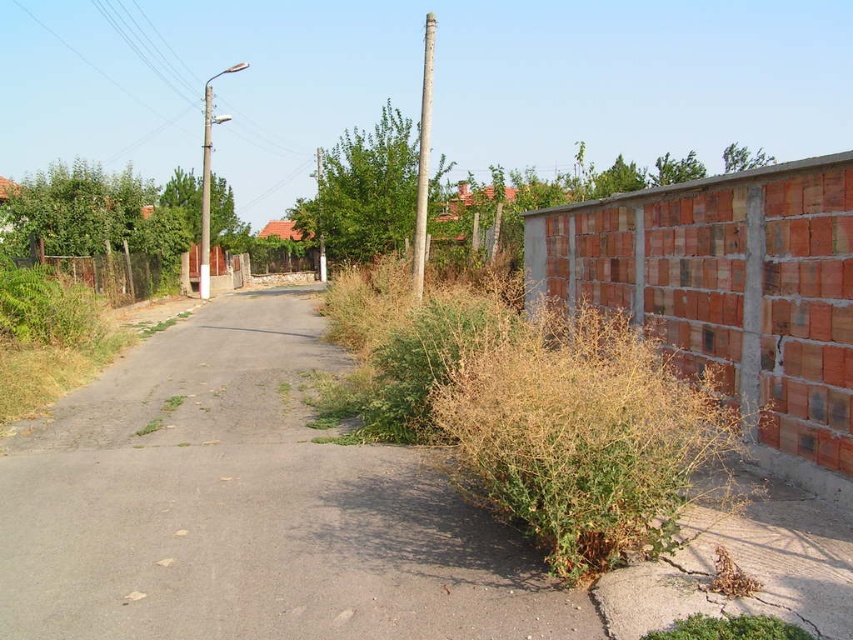
Is the position of gray asphalt driveway at center more distant than that of green leafy tree at center?

No, gray asphalt driveway at center is in front of green leafy tree at center.

Can you confirm if gray asphalt driveway at center is positioned to the left of green leafy tree at center?

In fact, gray asphalt driveway at center is to the right of green leafy tree at center.

Where is `gray asphalt driveway at center`? The width and height of the screenshot is (853, 640). gray asphalt driveway at center is located at coordinates (247, 508).